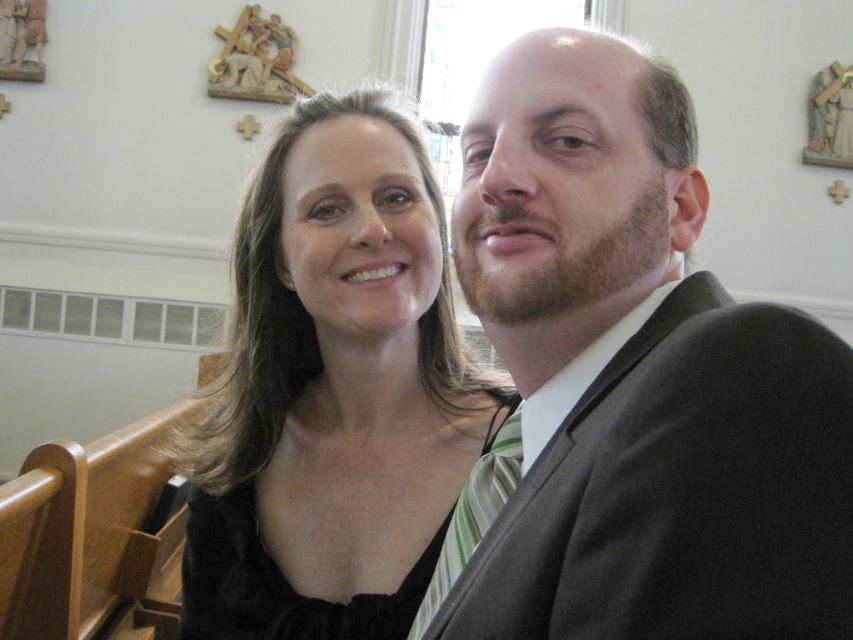
Question: Is dark gray suit at right behind black satin dress at center?

Choices:
 (A) no
 (B) yes

Answer: (A)

Question: Can you confirm if black satin dress at center is positioned above green striped tie at center?

Choices:
 (A) yes
 (B) no

Answer: (A)

Question: Is dark gray suit at right positioned behind green striped tie at center?

Choices:
 (A) yes
 (B) no

Answer: (B)

Question: Which point is farther from the camera taking this photo?

Choices:
 (A) (460, 552)
 (B) (271, 628)

Answer: (B)

Question: Which object is farther from the camera taking this photo?

Choices:
 (A) black satin dress at center
 (B) dark gray suit at right
 (C) green striped tie at center

Answer: (A)

Question: Which of these objects is positioned closest to the green striped tie at center?

Choices:
 (A) dark gray suit at right
 (B) black satin dress at center

Answer: (A)